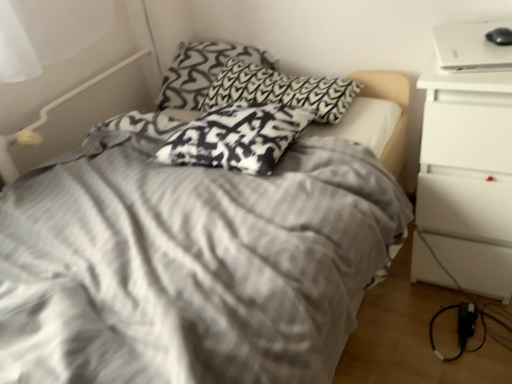
At what (x,y) coordinates should I click in order to perform the action: click on vacant space that is to the left of black and white patterned pillow at center, acting as the 3th pillow starting from the back. Please return your answer as a coordinate pair (x, y). Looking at the image, I should click on (102, 179).